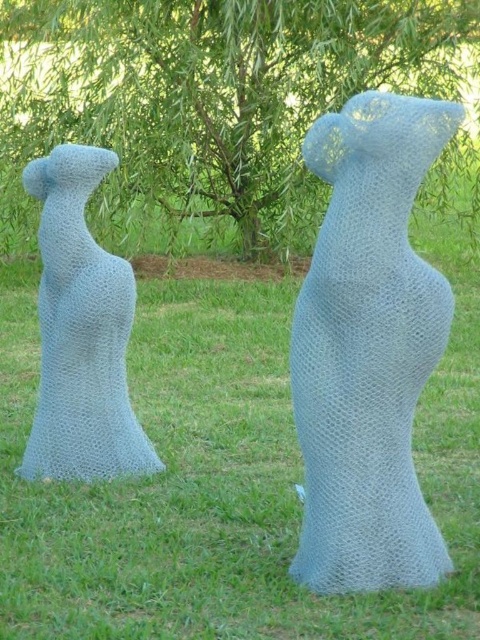
You are standing in the image and want to walk directly to the green leafy tree at center. Which direction should you move relative to your current position?

The green leafy tree at center is located at point 0.172 on the x axis and 0.463 on the y axis, so you should move towards the center of the image to reach it.

You are an artist planning to place a new sculpture between the light blue mesh bear at center and the textured blue sculpture at left. The new sculpture will be 30 inches wide. Can the space between them accommodate the new sculpture without overlapping?

The space between the light blue mesh bear at center and the textured blue sculpture at left is 38.52 inches. Since the new sculpture is 30 inches wide, it can fit within the available space without overlapping.

You are standing in a park and see the green leafy tree at center and the textured blue sculpture at left. Which object is wider?

The green leafy tree at center is wider than the textured blue sculpture at left.